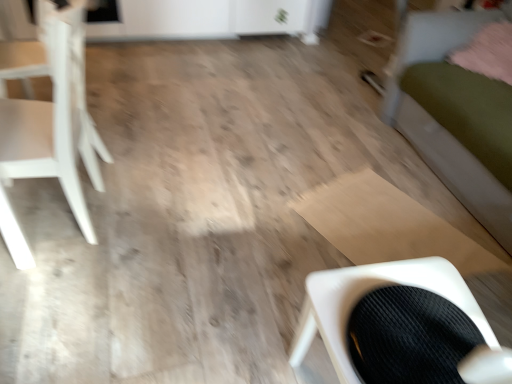
Locate an element on the screen. The width and height of the screenshot is (512, 384). vacant area on the back side of white matte chair at left, which appears as the first chair when viewed from the top is located at coordinates (133, 154).